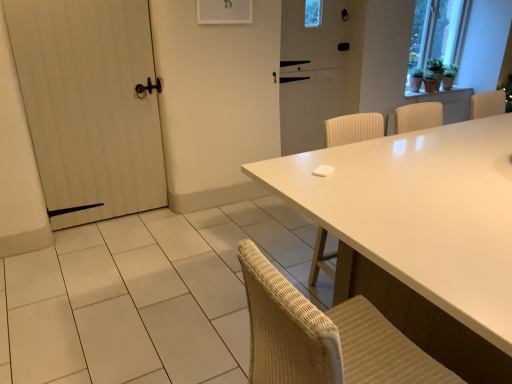
Find the location of a particular element. vacant space situated above white matte screen door at center (from a real-world perspective) is located at coordinates (320, 0).